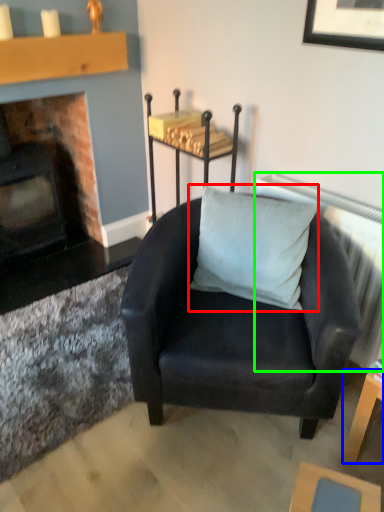
Question: Which object is positioned closest to pillow (highlighted by a red box)? Select from table (highlighted by a blue box) and radiator (highlighted by a green box).

Choices:
 (A) table
 (B) radiator

Answer: (B)